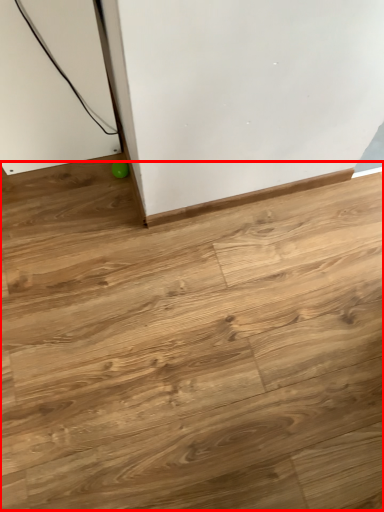
Question: Observing the image, what is the correct spatial positioning of plywood (annotated by the red box) in reference to ball?

Choices:
 (A) left
 (B) right

Answer: (B)